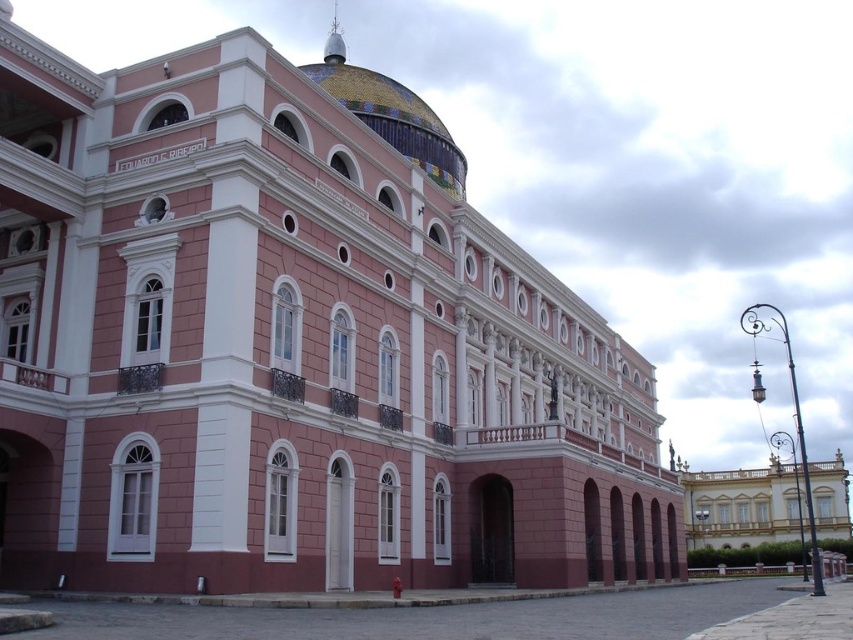
From the picture: You are an architect analyzing the building layout. The golden ornate palace at right and the multicolored mosaic dome at upper center are two key elements. Which of these two elements is smaller in size?

The golden ornate palace at right is smaller in size compared to the multicolored mosaic dome at upper center according to the description.

Consider the image. You are standing in front of the grand neoclassical building. You notice two prominent features, the golden ornate palace at right and the multicolored mosaic dome at upper center. Which of these two features is positioned to the right side of the other?

The golden ornate palace at right is positioned to the right of the multicolored mosaic dome at upper center.